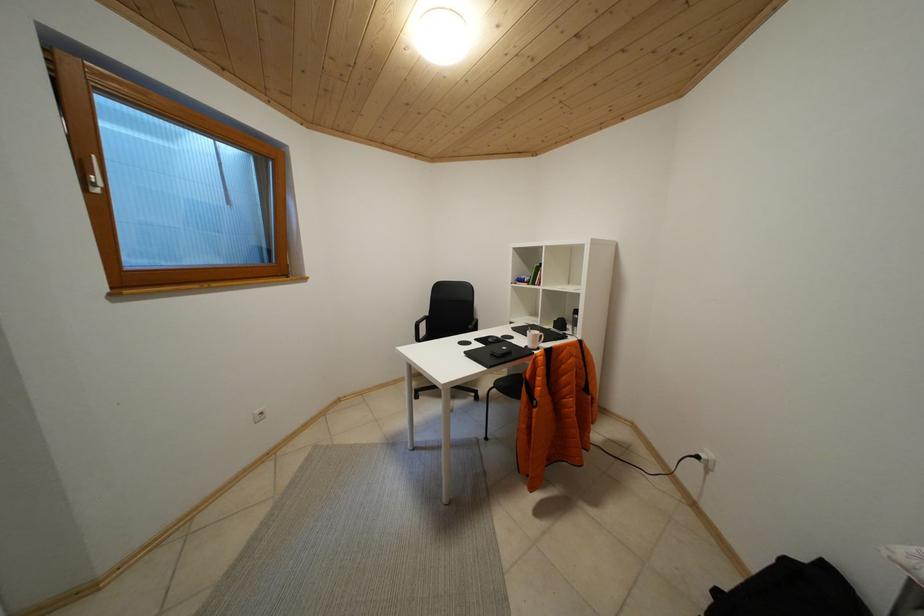
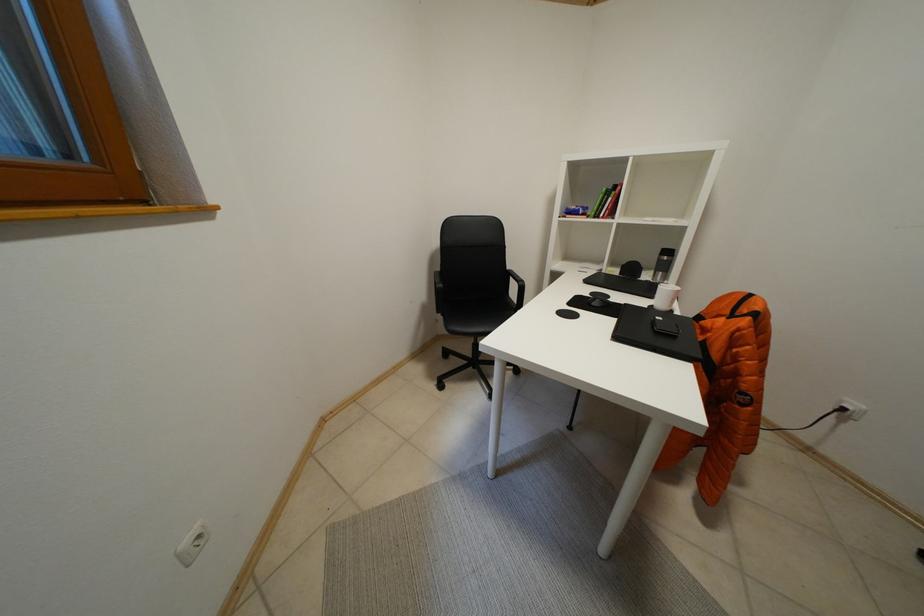
In a continuous first-person perspective shot, in which direction is the camera moving?

The cameraman walked toward left, forward.